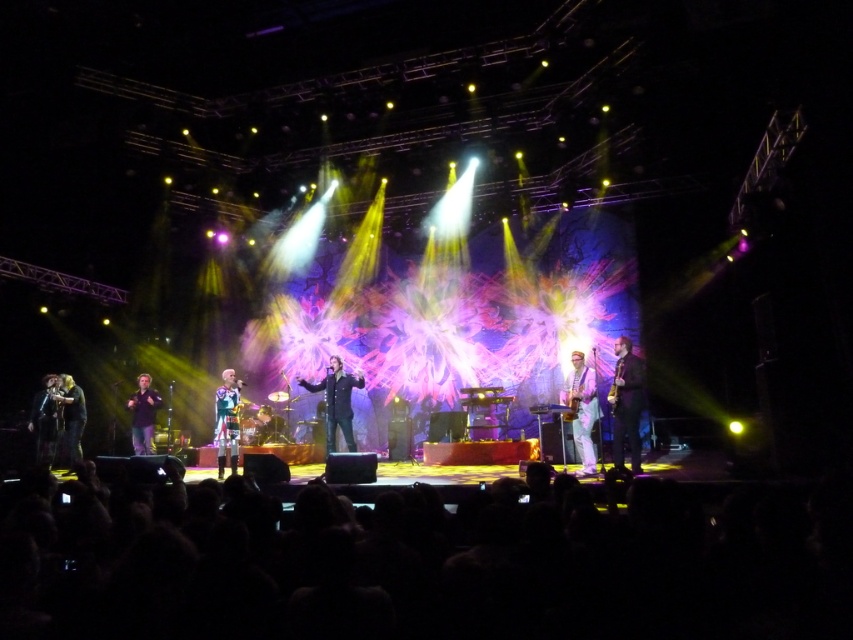
Question: Considering the real-world distances, which object is farthest from the brown leather jacket at right?

Choices:
 (A) black leather jacket at center
 (B) matte black shirt at left

Answer: (B)

Question: Is brown leather jacket at right below white glossy saxophone at center?

Choices:
 (A) no
 (B) yes

Answer: (A)

Question: Which point is closer to the camera?

Choices:
 (A) (332, 365)
 (B) (630, 364)

Answer: (B)

Question: Observing the image, what is the correct spatial positioning of brown leather jacket at right in reference to shiny silver jacket at center?

Choices:
 (A) right
 (B) left

Answer: (A)

Question: Which point is closer to the camera taking this photo?

Choices:
 (A) (32, 412)
 (B) (636, 428)
 (C) (583, 394)

Answer: (B)

Question: Does black leather jacket at center come behind dark brown leather jacket at left?

Choices:
 (A) no
 (B) yes

Answer: (A)